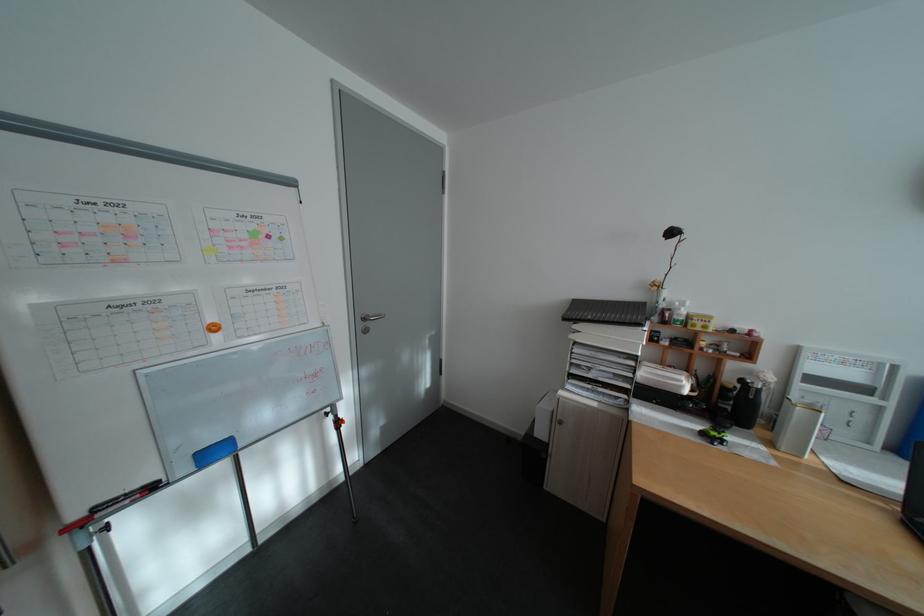
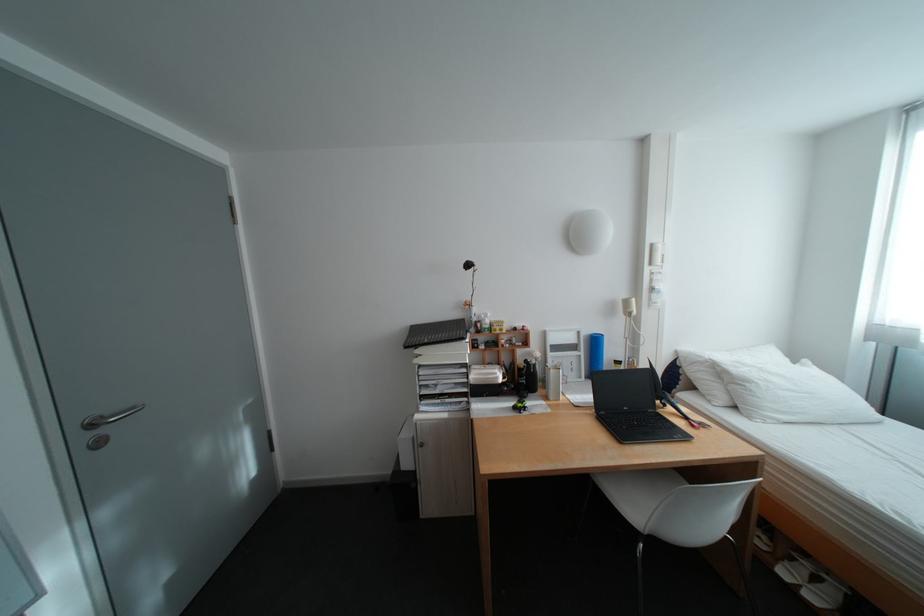
Find the pixel in the second image that matches pixel 709 426 in the first image.

(523, 403)